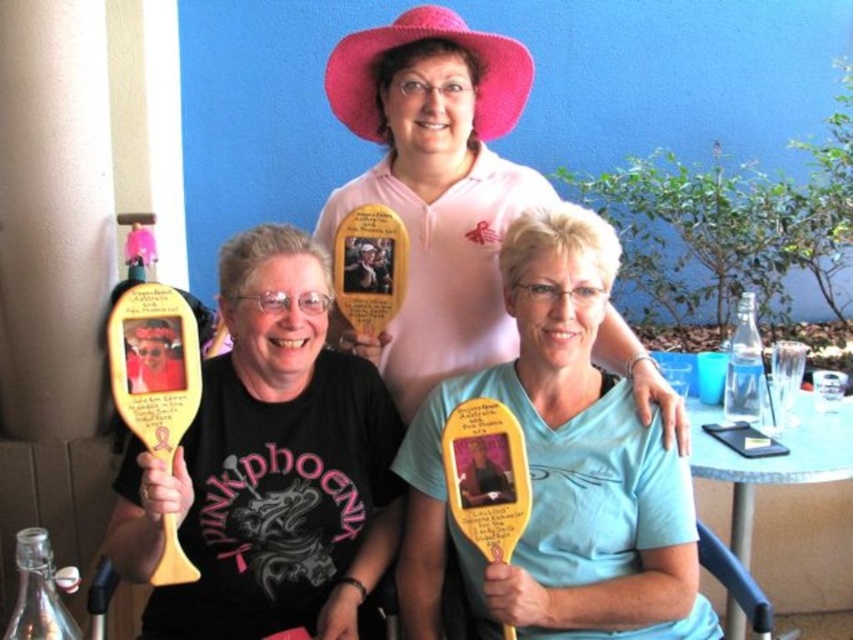
You are standing in the scene and want to hand a gift to the person wearing the light blue fabric shirt at center. Which direction should you walk to reach them?

The light blue fabric shirt at center is located at point 0.733 on the x axis and 0.658 on the y axis. Since you are facing the scene, you should walk towards the center of the image to reach the light blue fabric shirt at center.

You are at an outdoor event and see the matte wooden paddle at center and the transparent glass bottle at lower left. Which object is positioned higher in the image?

The matte wooden paddle at center is located above the transparent glass bottle at lower left, so it is positioned higher in the image.

You are at a picnic and want to grab a drink from the picnic basket. You see a transparent glass bottle at lower left and a clear glass bottle at right. Which one can you reach first without moving your position?

The transparent glass bottle at lower left is in front of the clear glass bottle at right, so you can reach the transparent glass bottle at lower left first without moving.